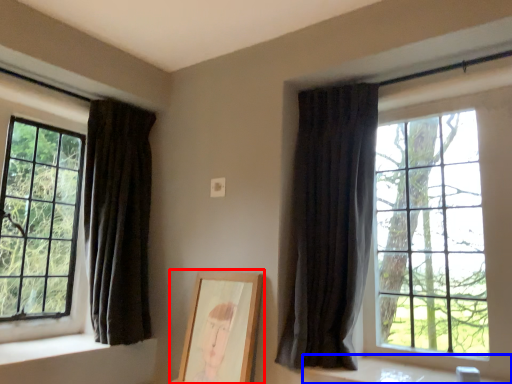
Question: Which object appears farthest to the camera in this image, picture frame (highlighted by a red box) or window sill (highlighted by a blue box)?

Choices:
 (A) picture frame
 (B) window sill

Answer: (A)